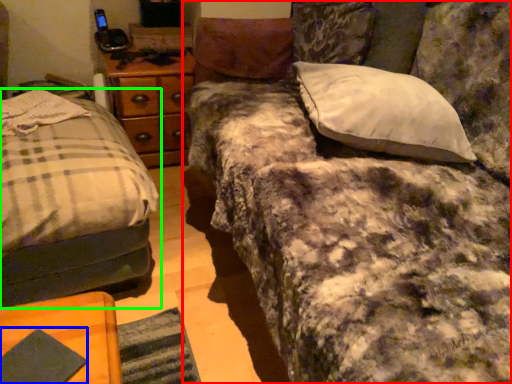
Question: Based on their relative distances, which object is nearer to studio couch (highlighted by a red box)? Choose from pad (highlighted by a blue box) and bed (highlighted by a green box).

Choices:
 (A) pad
 (B) bed

Answer: (B)